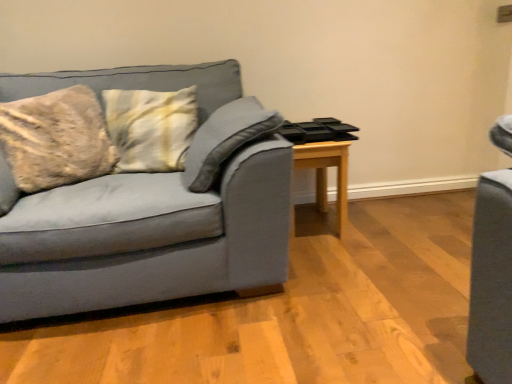
Measure the distance between point [224,189] and camera.

1.59 meters.

What do you see at coordinates (148, 238) in the screenshot? I see `matte gray couch at left` at bounding box center [148, 238].

Locate an element on the screen. Image resolution: width=512 pixels, height=384 pixels. matte gray couch at left is located at coordinates (148, 238).

Identify the location of light wood table at center. This screenshot has width=512, height=384. (326, 174).

Describe the element at coordinates (326, 174) in the screenshot. I see `light wood table at center` at that location.

Image resolution: width=512 pixels, height=384 pixels. Find the location of `matte gray couch at left`. matte gray couch at left is located at coordinates (148, 238).

Between light wood table at center and matte gray couch at left, which one appears on the left side from the viewer's perspective?

Positioned to the left is matte gray couch at left.

Looking at this image, which object is more forward, light wood table at center or matte gray couch at left?

matte gray couch at left.

Which is closer, (297, 163) or (120, 210)?

Point (297, 163).

From the image's perspective, does light wood table at center appear higher than matte gray couch at left?

No, from the image's perspective, light wood table at center is not on top of matte gray couch at left.

From a real-world perspective, which is physically below, light wood table at center or matte gray couch at left?

From a 3D spatial view, light wood table at center is below.

Considering the relative sizes of light wood table at center and matte gray couch at left in the image provided, is light wood table at center thinner than matte gray couch at left?

Yes, light wood table at center is thinner than matte gray couch at left.

Consider the image. Can you confirm if light wood table at center is shorter than matte gray couch at left?

Yes, light wood table at center is shorter than matte gray couch at left.

Considering the relative sizes of light wood table at center and matte gray couch at left in the image provided, is light wood table at center bigger than matte gray couch at left?

Actually, light wood table at center might be smaller than matte gray couch at left.

Which is correct: light wood table at center is inside matte gray couch at left, or outside of it?

light wood table at center is not enclosed by matte gray couch at left.

Based on the photo, are light wood table at center and matte gray couch at left located far from each other?

light wood table at center is near matte gray couch at left, not far away.

From the picture: Is light wood table at center looking in the opposite direction of matte gray couch at left?

No, light wood table at center's orientation is not away from matte gray couch at left.

Image resolution: width=512 pixels, height=384 pixels. I want to click on studio couch located in front of the light wood table at center, so click(148, 238).

Considering the relative positions of matte gray couch at left and light wood table at center in the image provided, is matte gray couch at left to the left or to the right of light wood table at center?

matte gray couch at left is to the left of light wood table at center.

Which object is closer to the camera, matte gray couch at left or light wood table at center?

matte gray couch at left is in front.

Does point (83, 242) lie in front of point (347, 168)?

Yes, it is in front of point (347, 168).

From the image's perspective, is matte gray couch at left located beneath light wood table at center?

Incorrect, from the image's perspective, matte gray couch at left is higher than light wood table at center.

From a real-world perspective, is matte gray couch at left positioned under light wood table at center based on gravity?

No, from a real-world perspective, matte gray couch at left is not below light wood table at center.

Is matte gray couch at left wider than light wood table at center?

Indeed, matte gray couch at left has a greater width compared to light wood table at center.

Between matte gray couch at left and light wood table at center, which one has less height?

With less height is light wood table at center.

Does matte gray couch at left have a smaller size compared to light wood table at center?

Incorrect, matte gray couch at left is not smaller in size than light wood table at center.

Is matte gray couch at left inside or outside of light wood table at center?

matte gray couch at left is spatially situated outside light wood table at center.

Are matte gray couch at left and light wood table at center making contact?

No, matte gray couch at left is not next to light wood table at center.

Could you tell me if matte gray couch at left is facing light wood table at center?

No, matte gray couch at left does not turn towards light wood table at center.

In the scene shown: Measure the distance from matte gray couch at left to light wood table at center.

matte gray couch at left and light wood table at center are 31.84 inches apart from each other.

At what (x,y) coordinates should I click in order to perform the action: click on table below the matte gray couch at left (from a real-world perspective). Please return your answer as a coordinate pair (x, y). Image resolution: width=512 pixels, height=384 pixels. Looking at the image, I should click on (326, 174).

Locate an element on the screen. The image size is (512, 384). studio couch that is in front of the light wood table at center is located at coordinates (148, 238).

Where is `table to the right of matte gray couch at left`? This screenshot has height=384, width=512. table to the right of matte gray couch at left is located at coordinates (326, 174).